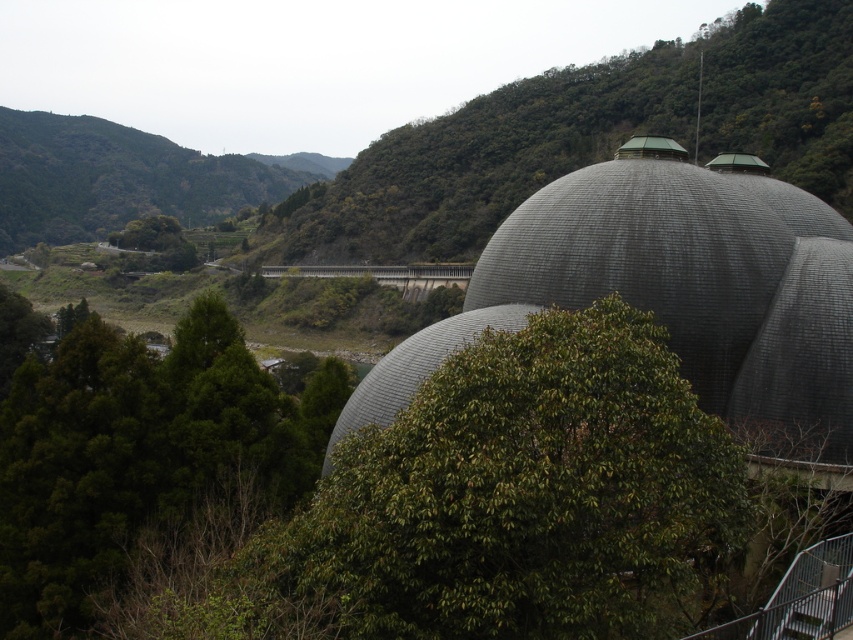
Can you confirm if green leafy tree at center is positioned to the left of green leafy tree at lower left?

In fact, green leafy tree at center is to the right of green leafy tree at lower left.

Is green leafy tree at center taller than green leafy tree at lower left?

Yes, green leafy tree at center is taller than green leafy tree at lower left.

Who is more forward, (819,113) or (79,541)?

Point (79,541)

Image resolution: width=853 pixels, height=640 pixels. Find the location of `green leafy tree at center`. green leafy tree at center is located at coordinates (590, 136).

Is gray textured dome at center to the left of green leafy tree at lower left from the viewer's perspective?

In fact, gray textured dome at center is to the right of green leafy tree at lower left.

Is point (390, 404) less distant than point (38, 465)?

No, (390, 404) is behind (38, 465).

Image resolution: width=853 pixels, height=640 pixels. I want to click on gray textured dome at center, so click(668, 284).

Who is taller, gray textured dome at center or green leafy tree at center?

green leafy tree at center is taller.

Does point (519, 227) come in front of point (819, 60)?

That is True.

This screenshot has width=853, height=640. What are the coordinates of `gray textured dome at center` in the screenshot? It's located at (x=668, y=284).